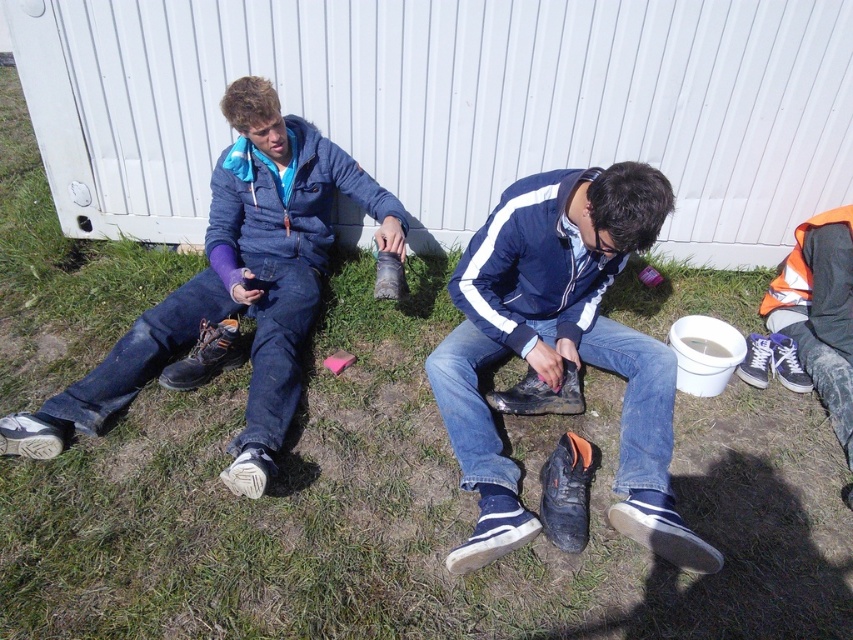
Question: Which object is the farthest from the white matte shoe at lower left?

Choices:
 (A) leather boot at center
 (B) blue canvas shoe at lower right
 (C) black canvas shoe at lower center
 (D) white canvas shoe at lower right

Answer: (B)

Question: Which object is positioned closest to the blue canvas shoe at lower right?

Choices:
 (A) white leather shoe at lower left
 (B) black rubber boot at center
 (C) white matte shoe at lower left
 (D) matte black shoe at center

Answer: (B)

Question: Does blue canvas shoe at lower right appear under white canvas shoe at lower right?

Choices:
 (A) no
 (B) yes

Answer: (B)

Question: Is white suede shoe at lower center to the right of white matte shoe at lower left from the viewer's perspective?

Choices:
 (A) yes
 (B) no

Answer: (A)

Question: Which object is farther from the camera taking this photo?

Choices:
 (A) matte blue jacket at upper left
 (B) white leather shoe at lower left

Answer: (A)

Question: Can you confirm if white canvas shoe at lower right is positioned to the right of leather boot at center?

Choices:
 (A) yes
 (B) no

Answer: (A)